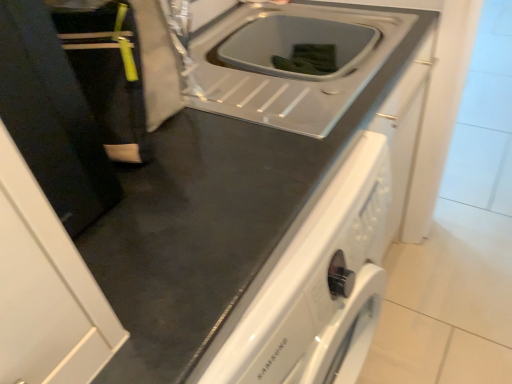
Question: Which is correct: black fabric at left is inside black matte door at left, or outside of it?

Choices:
 (A) inside
 (B) outside

Answer: (B)

Question: Based on their sizes in the image, would you say black fabric at left is bigger or smaller than black matte door at left?

Choices:
 (A) big
 (B) small

Answer: (B)

Question: Based on their relative distances, which object is farther from the white glossy sink at center?

Choices:
 (A) black matte door at left
 (B) black fabric at left

Answer: (A)

Question: Considering the real-world distances, which object is farthest from the black matte door at left?

Choices:
 (A) black fabric at left
 (B) white glossy sink at center

Answer: (B)